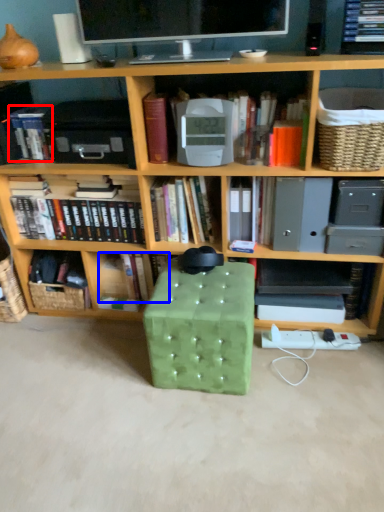
Question: Which of the following is the closest to the observer, book (highlighted by a red box) or book (highlighted by a blue box)?

Choices:
 (A) book
 (B) book

Answer: (A)